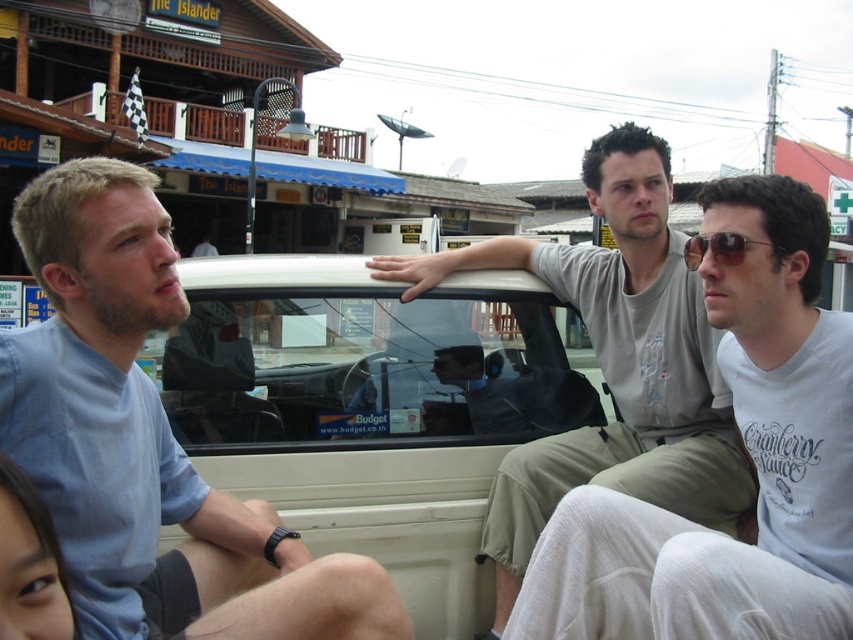
Between white fabric pickup truck at center and matte gray pickup truck at center, which one is positioned higher?

matte gray pickup truck at center is above.

Does white fabric pickup truck at center appear on the left side of matte gray pickup truck at center?

In fact, white fabric pickup truck at center is to the right of matte gray pickup truck at center.

Is point (619, 604) farther from viewer compared to point (695, 449)?

No, (619, 604) is closer to viewer.

The height and width of the screenshot is (640, 853). I want to click on white fabric pickup truck at center, so click(747, 451).

Is light blue shirt at left closer to camera compared to matte gray pickup truck at center?

Yes.

Does point (146, 284) come behind point (662, 307)?

No, it is not.

I want to click on light blue shirt at left, so pos(146,442).

From the picture: Can you confirm if white fabric pickup truck at center is bigger than sunglasses at center?

Yes.

Can you confirm if white fabric pickup truck at center is positioned below sunglasses at center?

Yes.

Find the location of `white fabric pickup truck at center`. white fabric pickup truck at center is located at coordinates (747, 451).